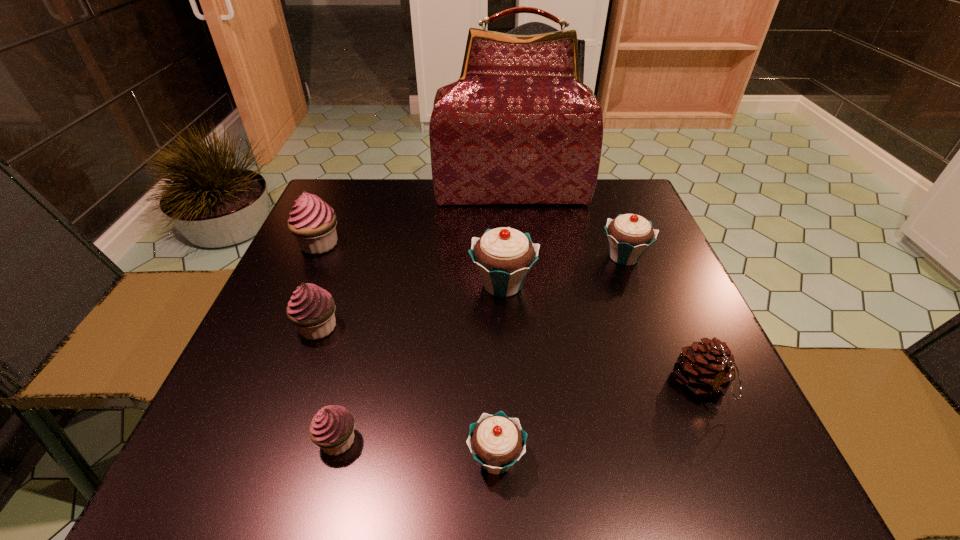
The height and width of the screenshot is (540, 960). What are the coordinates of `vacant area situated on the back of the smallest teal cupcake` in the screenshot? It's located at (492, 306).

Identify the location of object at the far edge. The height and width of the screenshot is (540, 960). (518, 127).

This screenshot has height=540, width=960. In order to click on handbag that is at the right edge in this screenshot , I will do `click(518, 127)`.

This screenshot has height=540, width=960. In order to click on cupcake located in the right edge section of the desktop in this screenshot , I will do `click(629, 235)`.

This screenshot has height=540, width=960. Find the location of `pinecone located at the right edge`. pinecone located at the right edge is located at coordinates (707, 368).

Identify the location of object that is at the far right corner. (518, 127).

Locate an element on the screen. The height and width of the screenshot is (540, 960). vacant space at the far edge of the desktop is located at coordinates (430, 213).

In the image, there is a desktop. At what (x,y) coordinates should I click in order to perform the action: click on vacant region at the near edge. Please return your answer as a coordinate pair (x, y). Looking at the image, I should click on (462, 491).

In the image, there is a desktop. At what (x,y) coordinates should I click in order to perform the action: click on vacant region at the left edge. Please return your answer as a coordinate pair (x, y). The width and height of the screenshot is (960, 540). Looking at the image, I should click on (280, 433).

This screenshot has width=960, height=540. Identify the location of vacant region at the right edge. (692, 333).